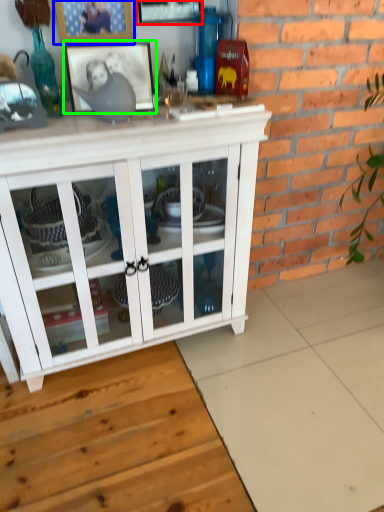
Question: Which object is the closest to the picture frame (highlighted by a red box)? Choose among these: picture frame (highlighted by a blue box) or picture frame (highlighted by a green box).

Choices:
 (A) picture frame
 (B) picture frame

Answer: (A)